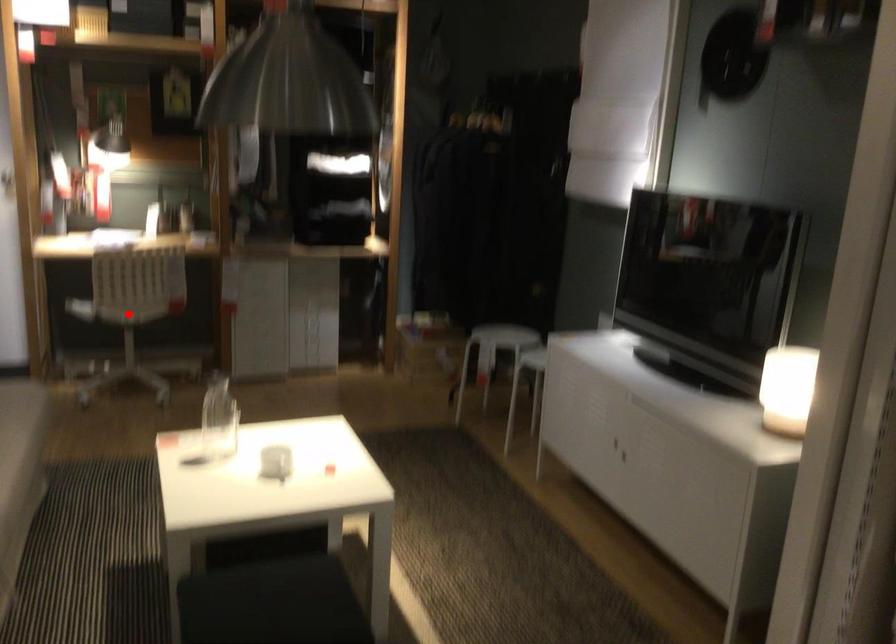
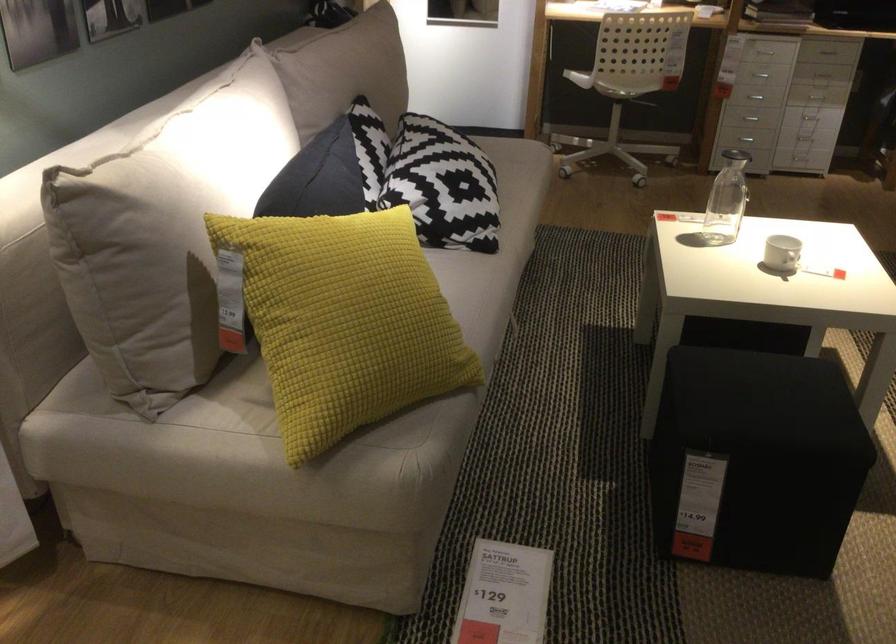
Where in the second image is the point corresponding to the highlighted location from the first image?

(627, 80)